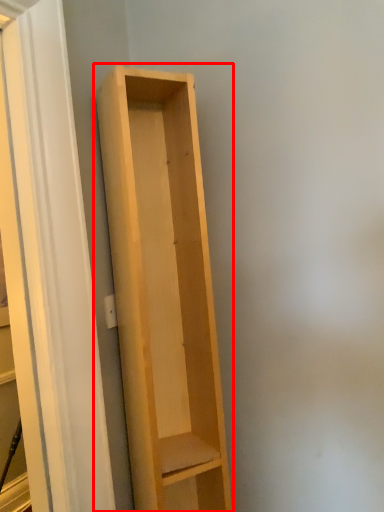
Question: From the image's perspective, what is the correct spatial relationship of shelf (annotated by the red box) in relation to screen door?

Choices:
 (A) below
 (B) above

Answer: (A)